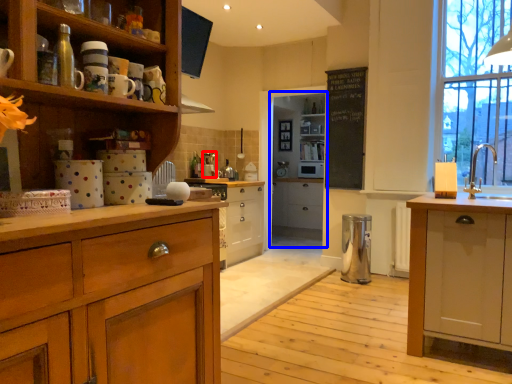
Question: Which object appears farthest to the camera in this image, coffee machine (highlighted by a red box) or cabinetry (highlighted by a blue box)?

Choices:
 (A) coffee machine
 (B) cabinetry

Answer: (B)